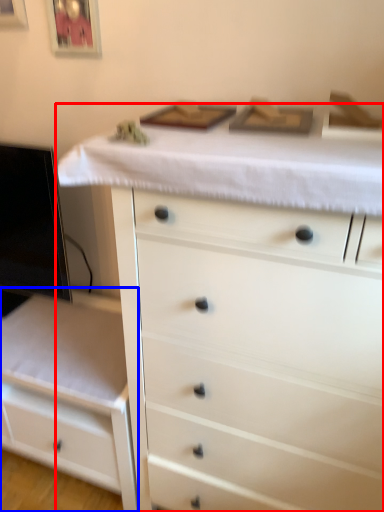
Question: Which object is further to the camera taking this photo, chest of drawers (highlighted by a red box) or chest of drawers (highlighted by a blue box)?

Choices:
 (A) chest of drawers
 (B) chest of drawers

Answer: (B)